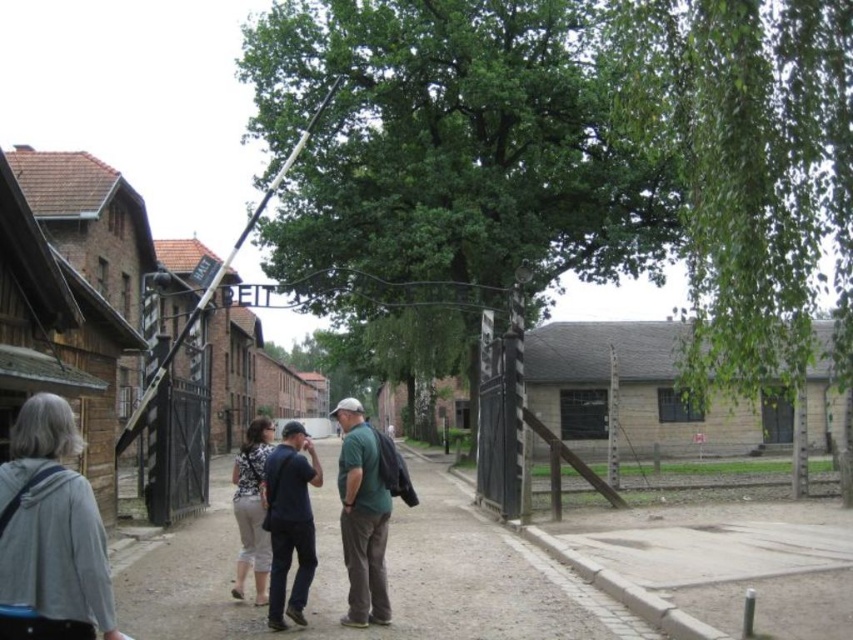
You are a tour guide leading a group through the historical site. You notice a visitor standing at the center of the scene. Where exactly is the brown dirt alley at center located relative to the dark blue jeans at center?

The brown dirt alley at center is to the left of the dark blue jeans at center.

You are a visitor at this historical site. You see a brown dirt alley at center and a green matte shirt at center. Which object is closer to the ground?

The brown dirt alley at center is positioned under the green matte shirt at center, so the brown dirt alley at center is closer to the ground.